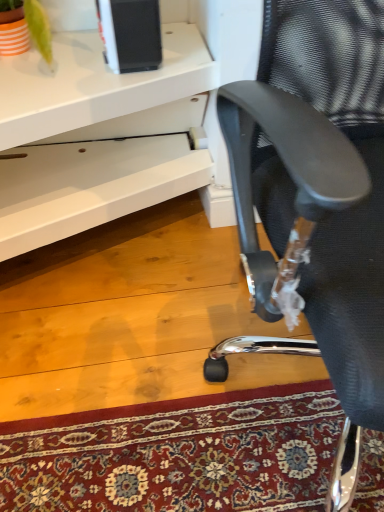
Question: From a real-world perspective, is black mesh chair at right physically located above or below white glossy desk at center?

Choices:
 (A) below
 (B) above

Answer: (B)

Question: Is black mesh chair at right wider or thinner than white glossy desk at center?

Choices:
 (A) wide
 (B) thin

Answer: (B)

Question: Is black mesh chair at right inside or outside of white glossy desk at center?

Choices:
 (A) outside
 (B) inside

Answer: (A)

Question: Is white glossy desk at center to the left or to the right of black mesh chair at right in the image?

Choices:
 (A) right
 (B) left

Answer: (B)

Question: Based on their sizes in the image, would you say white glossy desk at center is bigger or smaller than black mesh chair at right?

Choices:
 (A) big
 (B) small

Answer: (B)

Question: In terms of width, does white glossy desk at center look wider or thinner when compared to black mesh chair at right?

Choices:
 (A) wide
 (B) thin

Answer: (A)

Question: Do you think white glossy desk at center is within black mesh chair at right, or outside of it?

Choices:
 (A) outside
 (B) inside

Answer: (A)